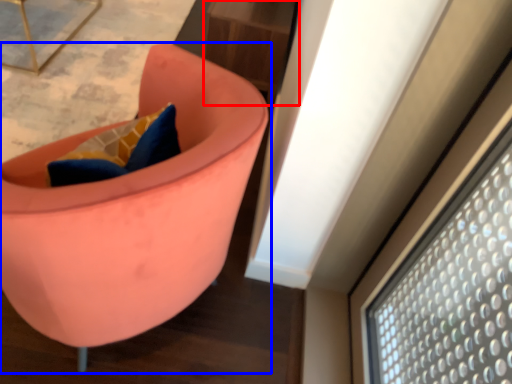
Question: Which of the following is the farthest to the observer, table (highlighted by a red box) or chair (highlighted by a blue box)?

Choices:
 (A) table
 (B) chair

Answer: (A)